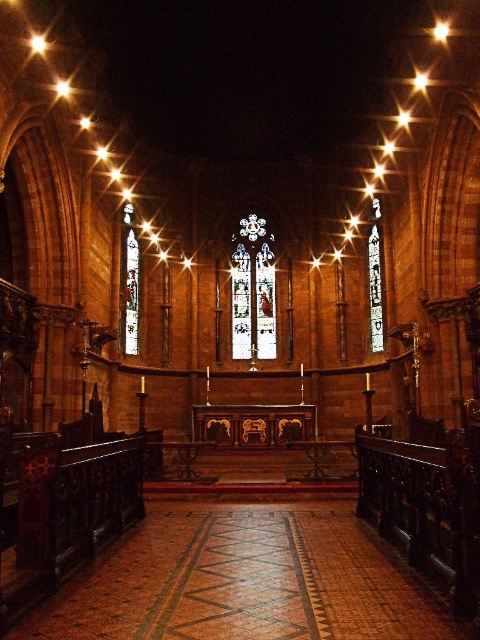
Question: Does clear glass stained glass at left have a lesser width compared to transparent stained glass at center?

Choices:
 (A) yes
 (B) no

Answer: (B)

Question: Which object is farther from the camera taking this photo?

Choices:
 (A) stained glass at center
 (B) clear glass stained glass at left

Answer: (A)

Question: Is stained glass at center positioned at the back of transparent stained glass at center?

Choices:
 (A) yes
 (B) no

Answer: (A)

Question: Does stained glass at center have a greater width compared to clear glass stained glass at left?

Choices:
 (A) no
 (B) yes

Answer: (B)

Question: Which object is farther from the camera taking this photo?

Choices:
 (A) stained glass at center
 (B) transparent stained glass at center
 (C) clear glass stained glass at left

Answer: (A)

Question: Which of the following is the farthest from the observer?

Choices:
 (A) stained glass at center
 (B) transparent stained glass at center

Answer: (A)